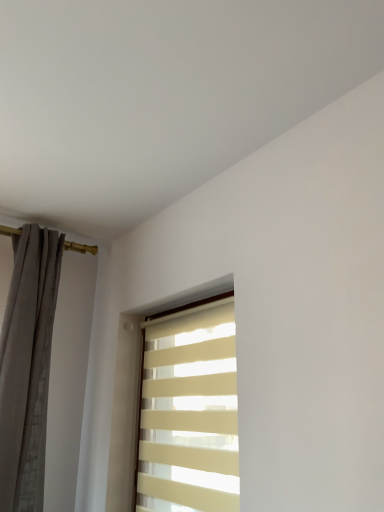
Question: Does gray textured curtain at left have a greater width compared to beige striped window at center?

Choices:
 (A) no
 (B) yes

Answer: (B)

Question: Considering the relative positions of gray textured curtain at left and beige striped window at center in the image provided, is gray textured curtain at left to the right of beige striped window at center from the viewer's perspective?

Choices:
 (A) yes
 (B) no

Answer: (B)

Question: Is gray textured curtain at left facing towards beige striped window at center?

Choices:
 (A) no
 (B) yes

Answer: (A)

Question: Is there a large distance between gray textured curtain at left and beige striped window at center?

Choices:
 (A) no
 (B) yes

Answer: (A)

Question: Is gray textured curtain at left outside beige striped window at center?

Choices:
 (A) yes
 (B) no

Answer: (A)

Question: Is gray textured curtain at left turned away from beige striped window at center?

Choices:
 (A) no
 (B) yes

Answer: (A)

Question: Is beige striped window at center positioned in front of gray textured curtain at left?

Choices:
 (A) yes
 (B) no

Answer: (A)

Question: Is beige striped window at center taller than gray textured curtain at left?

Choices:
 (A) yes
 (B) no

Answer: (B)

Question: Is beige striped window at center wider than gray textured curtain at left?

Choices:
 (A) yes
 (B) no

Answer: (B)

Question: Is beige striped window at center next to gray textured curtain at left and touching it?

Choices:
 (A) no
 (B) yes

Answer: (A)

Question: Can you confirm if beige striped window at center is thinner than gray textured curtain at left?

Choices:
 (A) no
 (B) yes

Answer: (B)

Question: Considering the relative sizes of beige striped window at center and gray textured curtain at left in the image provided, is beige striped window at center shorter than gray textured curtain at left?

Choices:
 (A) yes
 (B) no

Answer: (A)

Question: From a real-world perspective, is beige striped window at center physically located above or below gray textured curtain at left?

Choices:
 (A) above
 (B) below

Answer: (B)